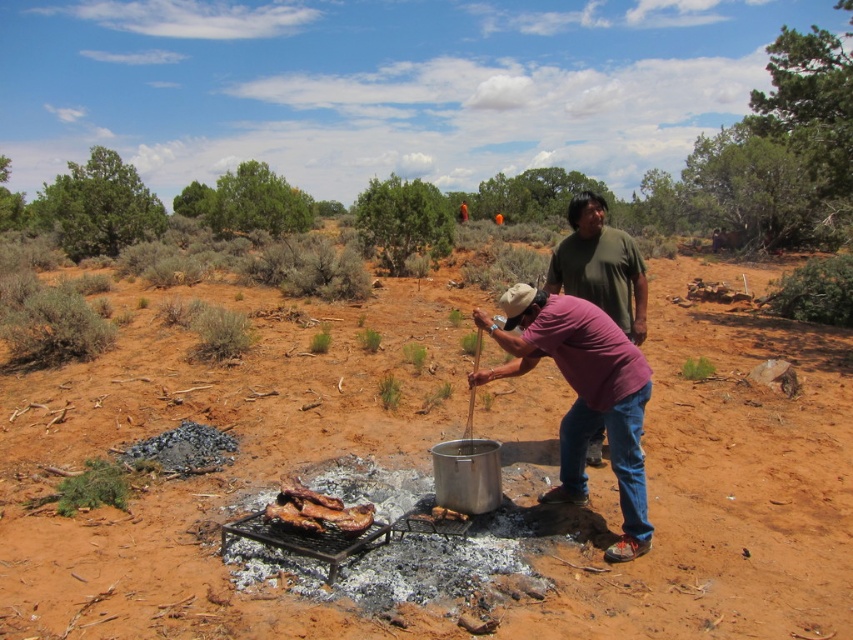
You are a hiker who wants to cook a meal using the charred wood at center. You see the purple cotton shirt at center nearby. Is the shirt in a position that could catch fire from the charred wood?

The purple cotton shirt at center is located above the charred wood at center, so it is positioned in a way that could potentially catch fire from the charred wood if sparks or flames rise upwards.